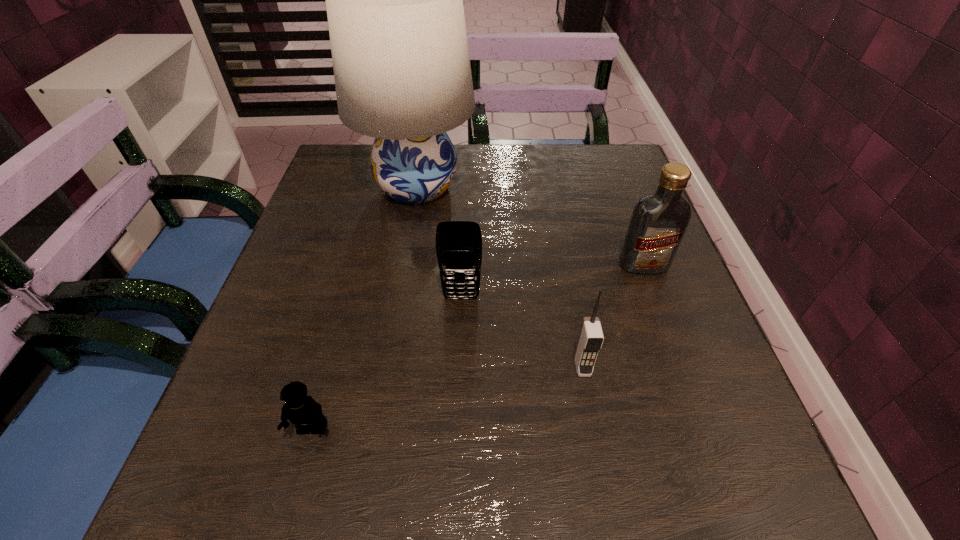
Where is `the farthest object`? This screenshot has height=540, width=960. the farthest object is located at coordinates (394, 0).

You are a GUI agent. You are given a task and a screenshot of the screen. Output one action in this format:
    pyautogui.click(x=<x>, y=<y>)
    Task: Click on the tallest object
    
    Given the screenshot: What is the action you would take?
    pyautogui.click(x=394, y=0)

Find the location of a particular element. The width and height of the screenshot is (960, 540). the second tallest object is located at coordinates (659, 220).

This screenshot has height=540, width=960. Find the location of `vodka`. vodka is located at coordinates (659, 220).

At what (x,y) coordinates should I click in order to perform the action: click on the left cellular telephone. Please return your answer as a coordinate pair (x, y). Image resolution: width=960 pixels, height=540 pixels. Looking at the image, I should click on (458, 243).

Find the location of `the farther cellular telephone`. the farther cellular telephone is located at coordinates (458, 243).

Identify the location of the fourth object from left to right. The image size is (960, 540). (590, 340).

Identify the location of the right cellular telephone. The image size is (960, 540). (590, 340).

The image size is (960, 540). I want to click on the shortest object, so click(303, 411).

Image resolution: width=960 pixels, height=540 pixels. What are the coordinates of `Lego` in the screenshot? It's located at (303, 411).